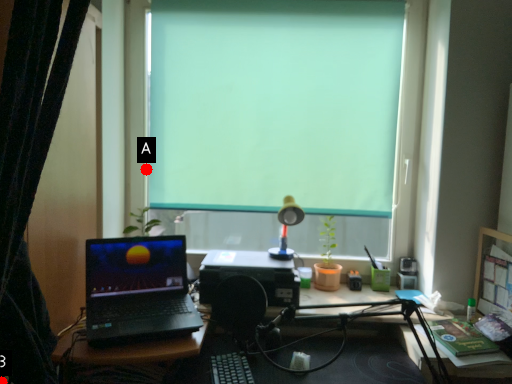
Question: Two points are circled on the image, labeled by A and B beside each circle. Which point appears farthest from the camera in this image?

Choices:
 (A) A is further
 (B) B is further

Answer: (A)